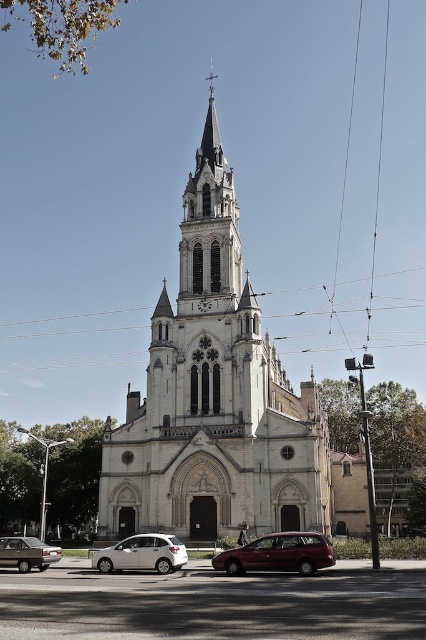
Question: Which point is farther to the camera?

Choices:
 (A) (227, 426)
 (B) (3, 538)
 (C) (164, 540)

Answer: (A)

Question: Which object appears closest to the camera in this image?

Choices:
 (A) metallic red minivan at lower center
 (B) matte silver sedan at lower left

Answer: (A)

Question: Which of the following is the farthest from the observer?

Choices:
 (A) metallic red minivan at lower center
 (B) white stone church at center
 (C) white matte hatchback at center
 (D) matte silver sedan at lower left

Answer: (D)

Question: Can you confirm if white matte hatchback at center is positioned to the left of matte silver sedan at lower left?

Choices:
 (A) no
 (B) yes

Answer: (A)

Question: Does metallic red minivan at lower center have a smaller size compared to matte silver sedan at lower left?

Choices:
 (A) yes
 (B) no

Answer: (A)

Question: Is metallic red minivan at lower center in front of white matte hatchback at center?

Choices:
 (A) no
 (B) yes

Answer: (B)